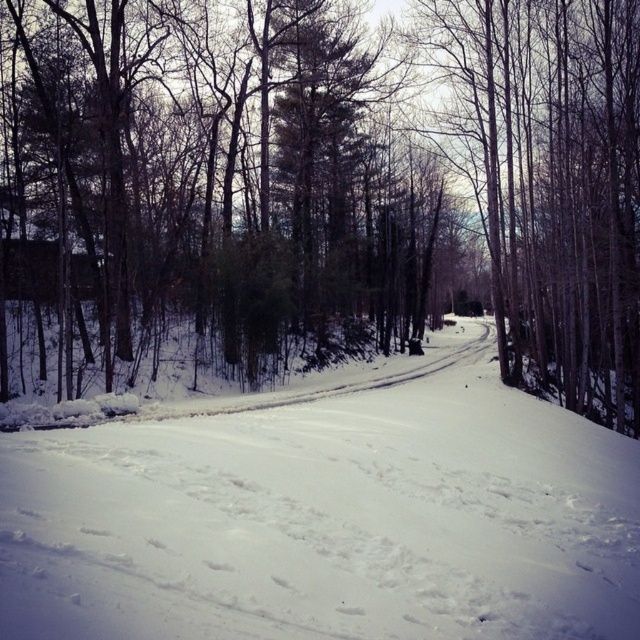
You are standing at the starting point of the road and want to reach the green textured pine tree at center. In which direction should you walk to get there?

The green textured pine tree at center is located at point (x=320, y=186) in 2D coordinates, so you should walk towards the center of the image to reach it.

You are standing at the point with coordinates (320,186) in the winter forest scene. What type of tree do you see there?

At point (320,186) lies a green textured pine tree at center.

You are a hiker trying to navigate through the forest. You see a green textured pine tree at center and white powdery snow at center. Which one is closer to you?

The green textured pine tree at center and white powdery snow at center are 16.57 meters apart, but the description does not specify which is closer. Therefore, it is impossible to determine which is closer based on the provided information.